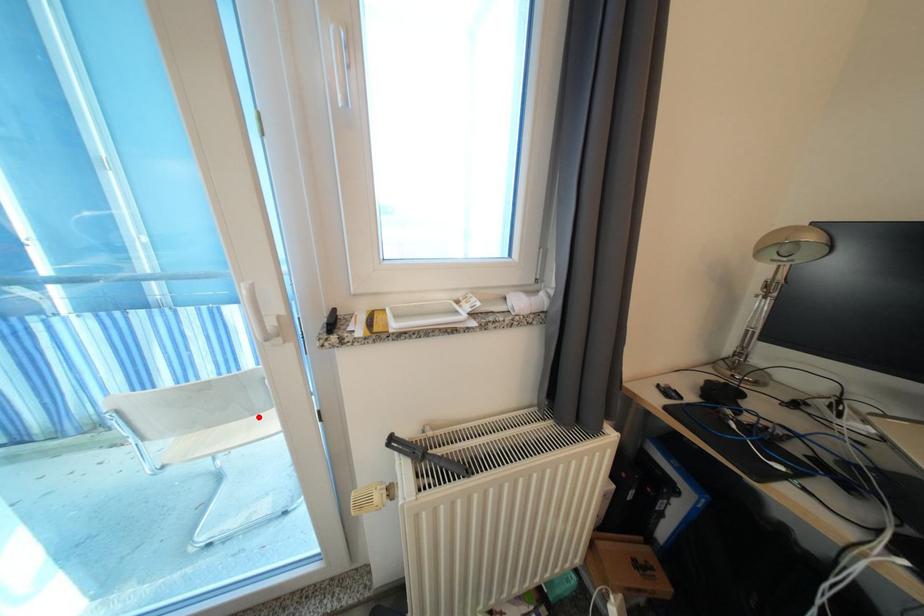
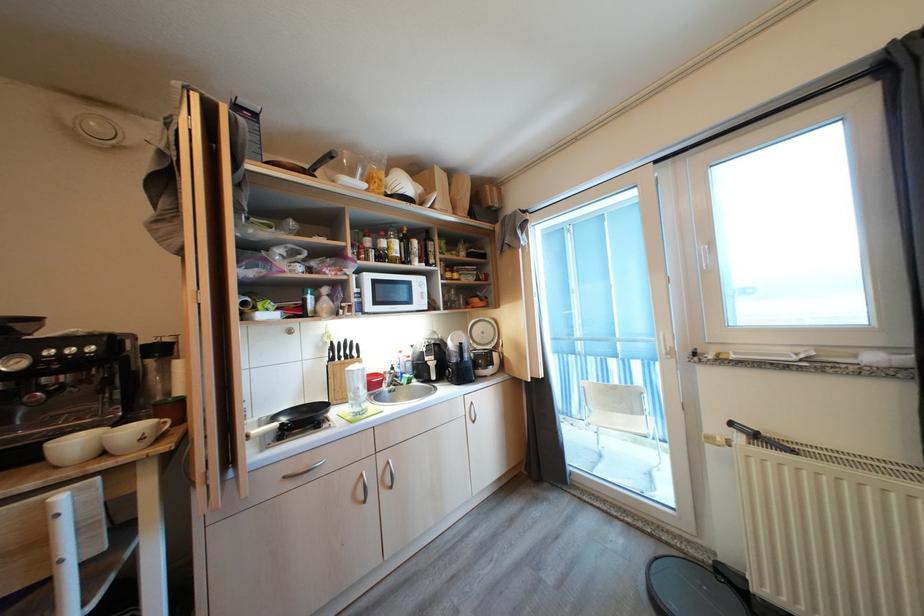
Where in the second image is the point corresponding to the highlighted location from the first image?

(637, 416)